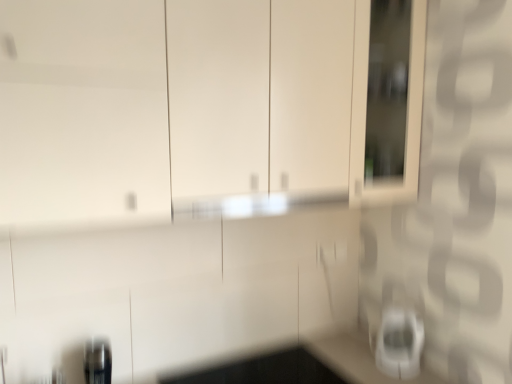
The height and width of the screenshot is (384, 512). I want to click on black glossy counter top at lower center, so click(x=302, y=367).

What do you see at coordinates (302, 367) in the screenshot? I see `black glossy counter top at lower center` at bounding box center [302, 367].

Measure the distance between black glossy counter top at lower center and camera.

The distance of black glossy counter top at lower center from camera is 4.80 feet.

What do you see at coordinates (399, 343) in the screenshot?
I see `white glossy coffee maker at lower right` at bounding box center [399, 343].

Locate an element on the screen. The height and width of the screenshot is (384, 512). white glossy coffee maker at lower right is located at coordinates (399, 343).

Locate an element on the screen. Image resolution: width=512 pixels, height=384 pixels. black glossy counter top at lower center is located at coordinates (302, 367).

Considering the positions of objects white glossy coffee maker at lower right and black glossy counter top at lower center in the image provided, who is more to the left, white glossy coffee maker at lower right or black glossy counter top at lower center?

From the viewer's perspective, black glossy counter top at lower center appears more on the left side.

In the scene shown: Relative to black glossy counter top at lower center, is white glossy coffee maker at lower right in front or behind?

Visually, white glossy coffee maker at lower right is located behind black glossy counter top at lower center.

Which is in front, point (380, 368) or point (319, 377)?

Positioned in front is point (319, 377).

From the image's perspective, is white glossy coffee maker at lower right beneath black glossy counter top at lower center?

No, from the image's perspective, white glossy coffee maker at lower right is not below black glossy counter top at lower center.

From a real-world perspective, which is physically below, white glossy coffee maker at lower right or black glossy counter top at lower center?

black glossy counter top at lower center, from a real-world perspective.

Which of these two, white glossy coffee maker at lower right or black glossy counter top at lower center, is wider?

Wider between the two is black glossy counter top at lower center.

Does white glossy coffee maker at lower right have a lesser height compared to black glossy counter top at lower center?

In fact, white glossy coffee maker at lower right may be taller than black glossy counter top at lower center.

In the scene shown: In terms of size, does white glossy coffee maker at lower right appear bigger or smaller than black glossy counter top at lower center?

Considering their sizes, white glossy coffee maker at lower right takes up less space than black glossy counter top at lower center.

Is white glossy coffee maker at lower right not within black glossy counter top at lower center?

Indeed, white glossy coffee maker at lower right is completely outside black glossy counter top at lower center.

Would you consider white glossy coffee maker at lower right to be distant from black glossy counter top at lower center?

That's not correct — white glossy coffee maker at lower right is a little close to black glossy counter top at lower center.

Is white glossy coffee maker at lower right facing towards black glossy counter top at lower center?

No, white glossy coffee maker at lower right does not turn towards black glossy counter top at lower center.

Locate an element on the screen. This screenshot has height=384, width=512. appliance above the black glossy counter top at lower center (from a real-world perspective) is located at coordinates (399, 343).

Which object is positioned more to the left, black glossy counter top at lower center or white glossy coffee maker at lower right?

black glossy counter top at lower center is more to the left.

Which object is further away from the camera taking this photo, black glossy counter top at lower center or white glossy coffee maker at lower right?

white glossy coffee maker at lower right.

Which is behind, point (220, 379) or point (419, 371)?

The point (220, 379) is more distant.

From the image's perspective, is black glossy counter top at lower center located above or below white glossy coffee maker at lower right?

Based on their image positions, black glossy counter top at lower center is located beneath white glossy coffee maker at lower right.

From a real-world perspective, is black glossy counter top at lower center over white glossy coffee maker at lower right?

Actually, black glossy counter top at lower center is physically below white glossy coffee maker at lower right in the real world.

Which of these two, black glossy counter top at lower center or white glossy coffee maker at lower right, is wider?

black glossy counter top at lower center.

Looking at this image, is black glossy counter top at lower center shorter than white glossy coffee maker at lower right?

Yes.

Considering the sizes of objects black glossy counter top at lower center and white glossy coffee maker at lower right in the image provided, who is smaller, black glossy counter top at lower center or white glossy coffee maker at lower right?

Smaller between the two is white glossy coffee maker at lower right.

Is black glossy counter top at lower center spatially inside white glossy coffee maker at lower right, or outside of it?

The correct answer is: outside.

Are black glossy counter top at lower center and white glossy coffee maker at lower right located far from each other?

That's not correct — black glossy counter top at lower center is a little close to white glossy coffee maker at lower right.

Is black glossy counter top at lower center facing towards white glossy coffee maker at lower right?

No.

Consider the image. How many degrees apart are the facing directions of black glossy counter top at lower center and white glossy coffee maker at lower right?

The angle between the facing direction of black glossy counter top at lower center and the facing direction of white glossy coffee maker at lower right is 1.4 degrees.

Find the location of a particular element. This screenshot has width=512, height=384. counter top that is on the left side of white glossy coffee maker at lower right is located at coordinates (302, 367).

Locate an element on the screen. This screenshot has height=384, width=512. counter top to the left of white glossy coffee maker at lower right is located at coordinates (302, 367).

At what (x,y) coordinates should I click in order to perform the action: click on counter top that is in front of the white glossy coffee maker at lower right. Please return your answer as a coordinate pair (x, y). The width and height of the screenshot is (512, 384). Looking at the image, I should click on (302, 367).